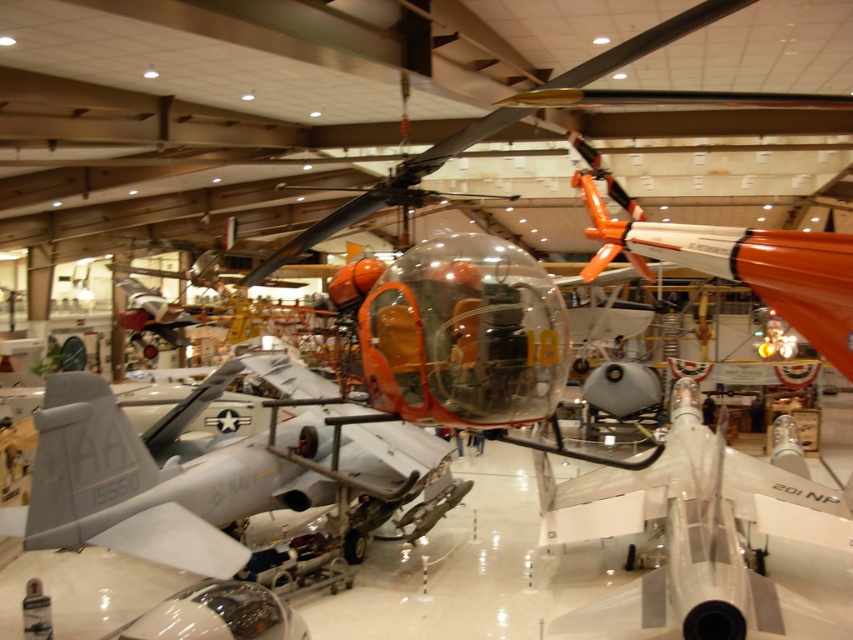
Question: From the image, what is the correct spatial relationship of matte gray aircraft at center in relation to white glossy airplane at center?

Choices:
 (A) below
 (B) above

Answer: (B)

Question: Which object is farther from the camera taking this photo?

Choices:
 (A) white glossy airplane at center
 (B) matte gray aircraft at center

Answer: (B)

Question: Observing the image, what is the correct spatial positioning of matte gray aircraft at center in reference to white glossy airplane at center?

Choices:
 (A) above
 (B) below

Answer: (A)

Question: Can you confirm if matte gray aircraft at center is thinner than white glossy airplane at center?

Choices:
 (A) yes
 (B) no

Answer: (B)